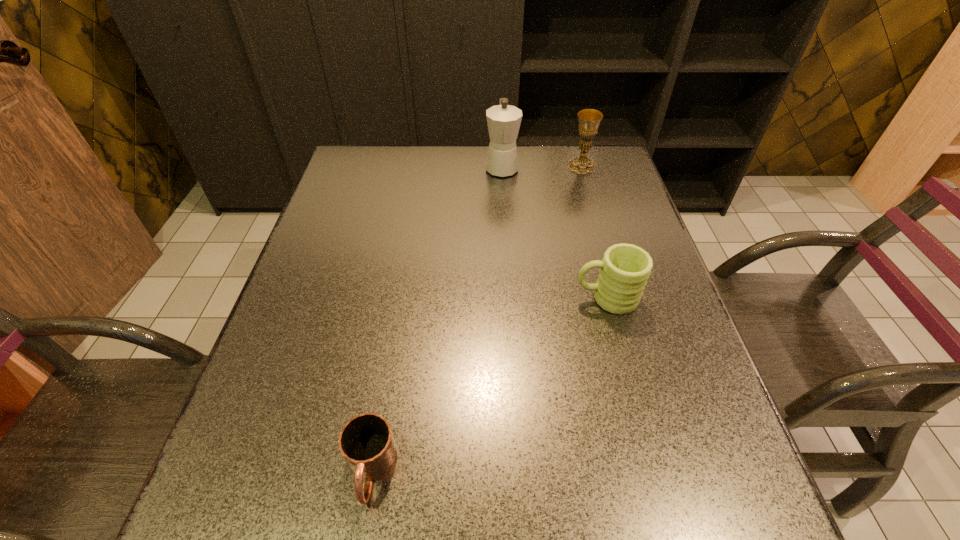
Where is `the tallest object`? This screenshot has height=540, width=960. the tallest object is located at coordinates (503, 120).

Find the location of `the second object from left to right`. the second object from left to right is located at coordinates click(x=503, y=120).

Where is `chalice`? chalice is located at coordinates (589, 119).

At what (x,y) coordinates should I click in order to perform the action: click on the third farthest object. Please return your answer as a coordinate pair (x, y). Looking at the image, I should click on (624, 270).

Identify the location of the right mug. (624, 270).

Find the location of a particular element. The height and width of the screenshot is (540, 960). the nearer mug is located at coordinates (366, 442).

I want to click on the nearest object, so click(366, 442).

This screenshot has width=960, height=540. Identify the location of vacant position located 0.270m on the right of the second object from left to right. (604, 167).

Locate an element on the screen. Image resolution: width=960 pixels, height=540 pixels. vacant area situated on the back of the chalice is located at coordinates (577, 150).

This screenshot has height=540, width=960. I want to click on vacant space situated 0.070m on the side of the right mug with the handle, so click(542, 298).